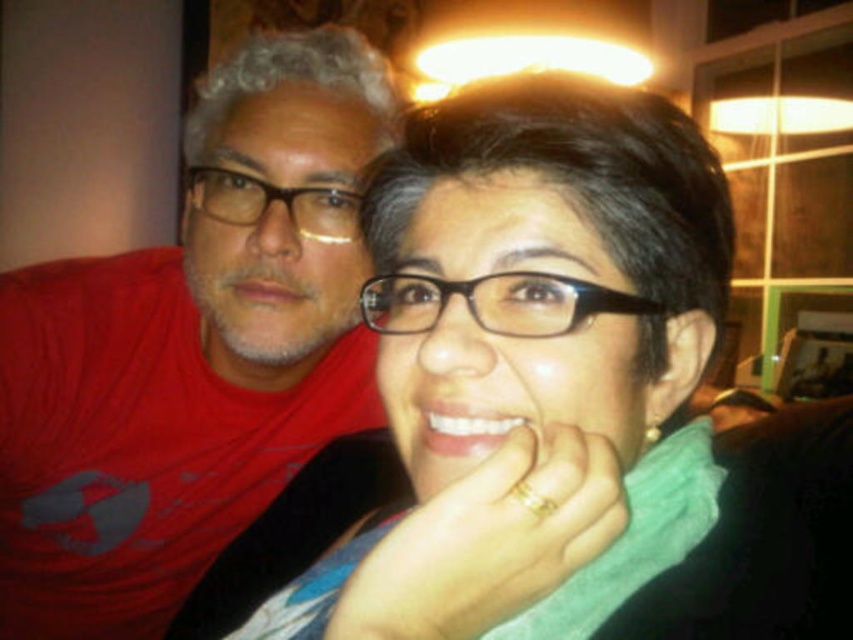
You are standing in the room and see the point at coordinates (x=190, y=349). Which object is this point located on?

The point at coordinates (x=190, y=349) is located on the matte red t shirt at left.

You are standing in the room and want to hand a pair of glasses to someone without moving closer. The glasses you have are exactly the same as the matte black glasses at center in the image. Can you reach them from your current position if the average arm length is 28 inches?

The distance between you and the matte black glasses at center is 14.36 inches, which is less than the average arm length of 28 inches. Therefore, you can reach them without moving closer.

You are trying to decide which pair of matte black glasses to choose for a presentation. You want the taller one to make a stronger impression. Which one should you pick between the matte black glasses at center and the matte black glasses at upper left?

The matte black glasses at center is much taller than the matte black glasses at upper left, so you should pick the matte black glasses at center to make a stronger impression.